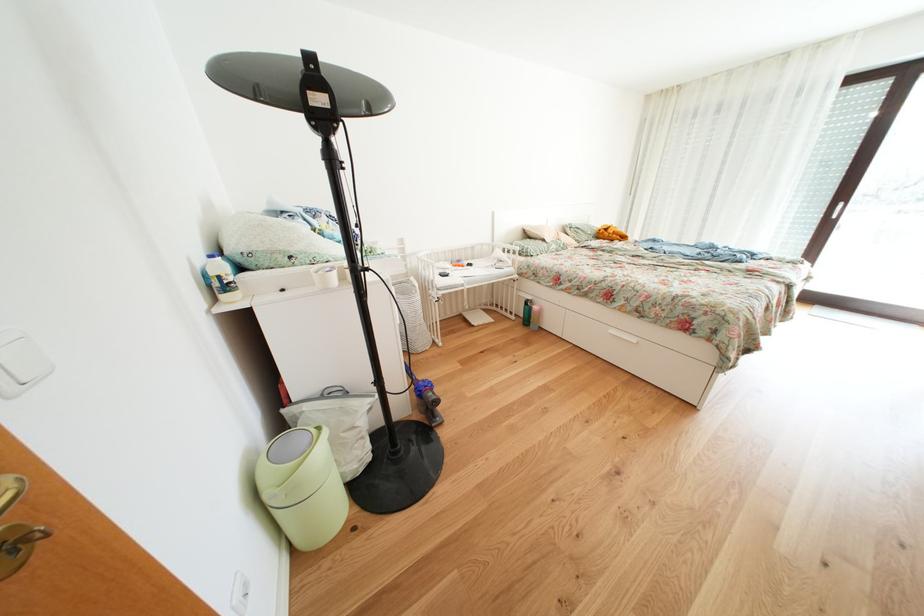
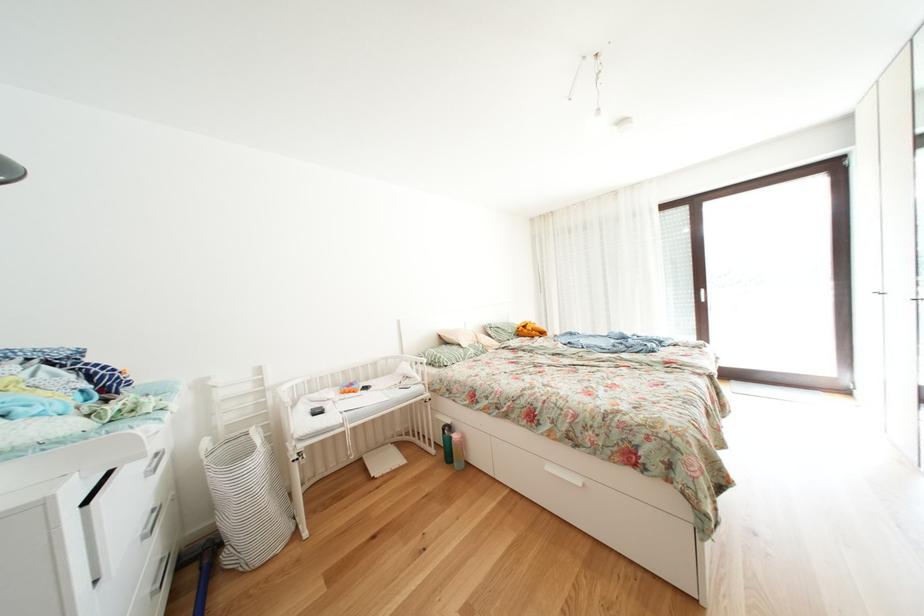
The point at (622, 336) is marked in the first image. Where is the corresponding point in the second image?

(558, 472)